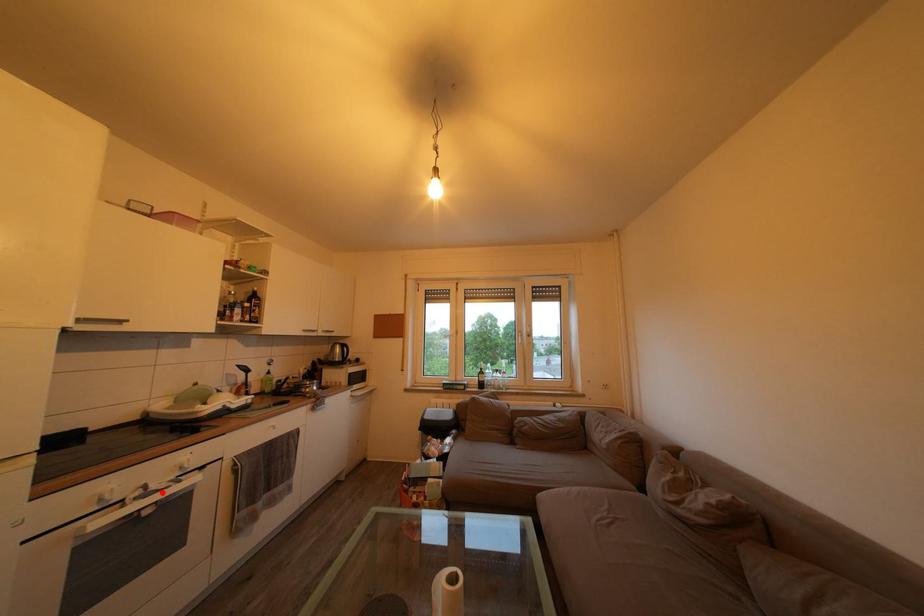
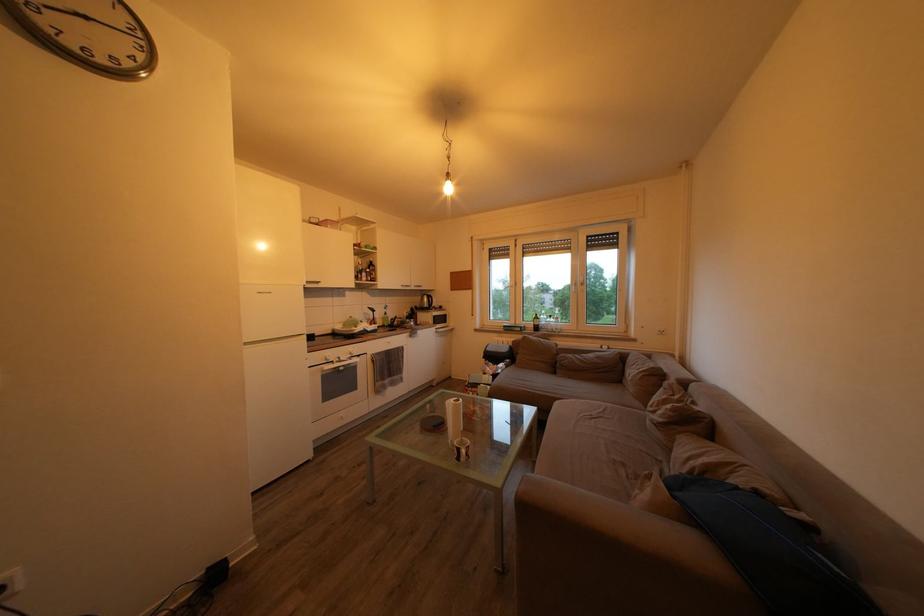
The point at the highlighted location is marked in the first image. Where is the corresponding point in the second image?

(349, 363)